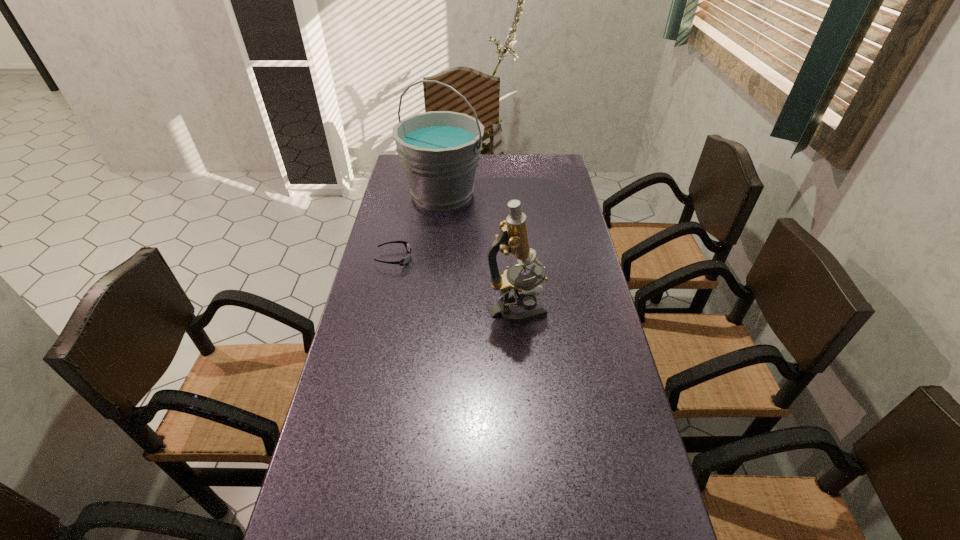
The image size is (960, 540). In order to click on bucket present at the left edge in this screenshot , I will do `click(439, 150)`.

At what (x,y) coordinates should I click in order to perform the action: click on sunglasses that is at the left edge. Please return your answer as a coordinate pair (x, y). The height and width of the screenshot is (540, 960). Looking at the image, I should click on (404, 261).

Locate an element on the screen. This screenshot has height=540, width=960. object that is at the far left corner is located at coordinates (439, 150).

Identify the location of free space at the far edge. This screenshot has width=960, height=540. coord(516,165).

The height and width of the screenshot is (540, 960). In order to click on vacant space at the left edge of the desktop in this screenshot , I will do `click(389, 375)`.

You are a GUI agent. You are given a task and a screenshot of the screen. Output one action in this format:
    pyautogui.click(x=<x>, y=<y>)
    Task: Click on the vacant space at the right edge of the desktop
    
    Given the screenshot: What is the action you would take?
    pyautogui.click(x=563, y=380)

I want to click on vacant space at the far right corner of the desktop, so click(x=558, y=176).

Locate an element on the screen. This screenshot has height=540, width=960. vacant region between the nearest object and the shortest object is located at coordinates (455, 284).

At what (x,y) coordinates should I click in order to perform the action: click on unoccupied position between the microscope and the bucket. Please return your answer as a coordinate pair (x, y). Looking at the image, I should click on (479, 252).

Locate an element on the screen. This screenshot has height=540, width=960. free space between the second tallest object and the sunglasses is located at coordinates (x=455, y=284).